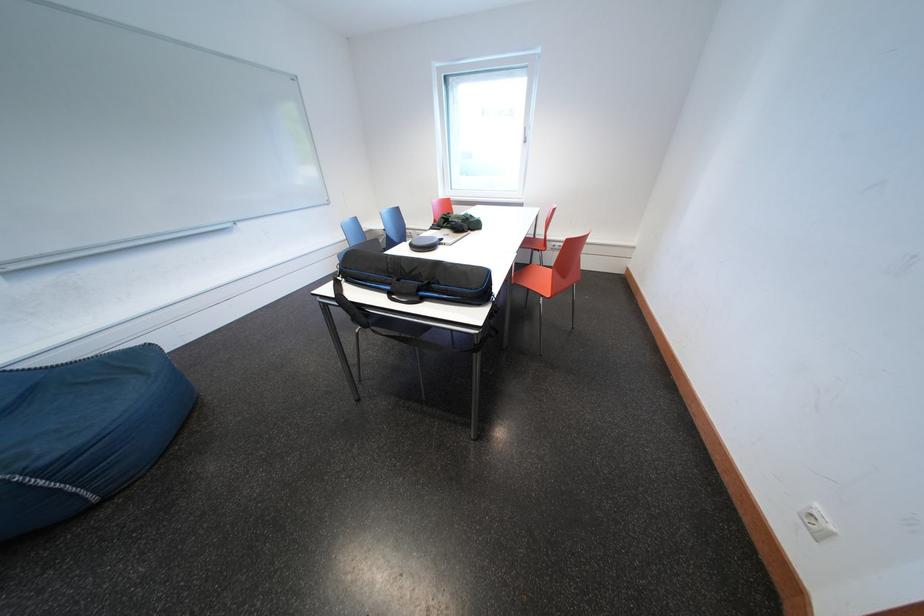
This screenshot has width=924, height=616. Describe the element at coordinates (525, 134) in the screenshot. I see `the white window handle` at that location.